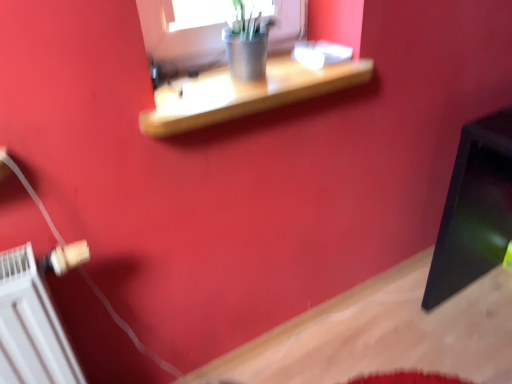
Locate an element on the screen. The image size is (512, 384). vacant region above wooden shelf at upper center (from a real-world perspective) is located at coordinates (249, 80).